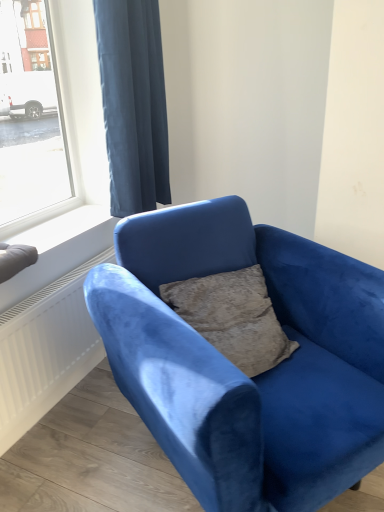
Question: Is dark blue fabric curtain at upper left at the left side of velvet blue couch at center?

Choices:
 (A) no
 (B) yes

Answer: (B)

Question: Is dark blue fabric curtain at upper left to the right of velvet blue couch at center from the viewer's perspective?

Choices:
 (A) no
 (B) yes

Answer: (A)

Question: Are dark blue fabric curtain at upper left and velvet blue couch at center located far from each other?

Choices:
 (A) yes
 (B) no

Answer: (B)

Question: Is dark blue fabric curtain at upper left closer to the viewer compared to velvet blue couch at center?

Choices:
 (A) yes
 (B) no

Answer: (B)

Question: From a real-world perspective, is dark blue fabric curtain at upper left positioned under velvet blue couch at center based on gravity?

Choices:
 (A) yes
 (B) no

Answer: (B)

Question: Can you confirm if dark blue fabric curtain at upper left is smaller than velvet blue couch at center?

Choices:
 (A) no
 (B) yes

Answer: (B)

Question: Does dark blue fabric curtain at upper left have a larger size compared to white smooth window sill at lower left?

Choices:
 (A) no
 (B) yes

Answer: (B)

Question: Is dark blue fabric curtain at upper left located outside white smooth window sill at lower left?

Choices:
 (A) yes
 (B) no

Answer: (A)

Question: Are dark blue fabric curtain at upper left and white smooth window sill at lower left beside each other?

Choices:
 (A) yes
 (B) no

Answer: (B)

Question: Can you confirm if dark blue fabric curtain at upper left is positioned to the right of white smooth window sill at lower left?

Choices:
 (A) yes
 (B) no

Answer: (A)

Question: Does dark blue fabric curtain at upper left have a greater width compared to white smooth window sill at lower left?

Choices:
 (A) yes
 (B) no

Answer: (B)

Question: Could you tell me if dark blue fabric curtain at upper left is facing white smooth window sill at lower left?

Choices:
 (A) yes
 (B) no

Answer: (B)

Question: Is velvet blue couch at center facing towards white smooth window sill at lower left?

Choices:
 (A) no
 (B) yes

Answer: (A)